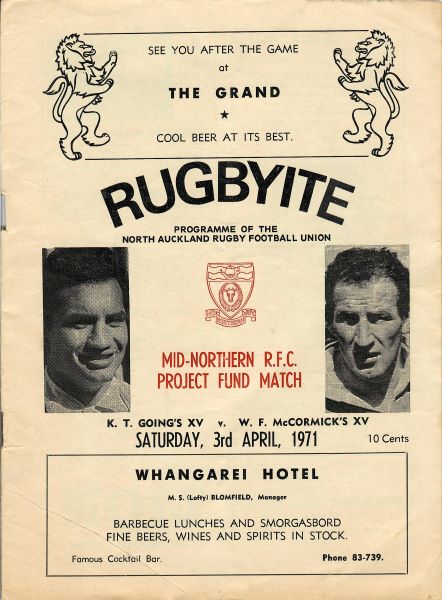
The image size is (442, 600). Identify the location of pictures. coord(96,305), coord(381,345).